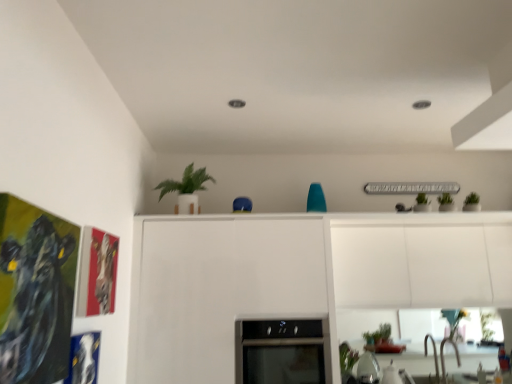
Question: Is black glass oven at center inside or outside of green matte plant at lower center?

Choices:
 (A) outside
 (B) inside

Answer: (A)

Question: Considering the positions of point (247, 372) and point (339, 344), is point (247, 372) closer or farther from the camera than point (339, 344)?

Choices:
 (A) farther
 (B) closer

Answer: (B)

Question: Based on their relative distances, which object is farther from the green matte plant at lower center?

Choices:
 (A) metallic silver faucet at lower right
 (B) black glass oven at center
 (C) green matte plant at upper center

Answer: (C)

Question: Based on their relative distances, which object is nearer to the green matte plant at lower center?

Choices:
 (A) metallic silver faucet at lower right
 (B) black glass oven at center
 (C) green matte plant at upper center

Answer: (B)